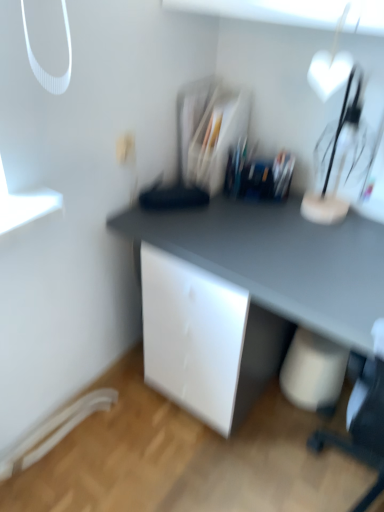
What is the approximate height of white glossy heart-shaped object at upper right?

white glossy heart-shaped object at upper right is 20.17 inches in height.

At what (x,y) coordinates should I click in order to perform the action: click on clear plastic organizer at center. Please return your answer as a coordinate pair (x, y). The width and height of the screenshot is (384, 512). Looking at the image, I should click on (209, 130).

Considering the relative sizes of matte gray desk at center and white glossy heart-shaped object at upper right in the image provided, is matte gray desk at center bigger than white glossy heart-shaped object at upper right?

Yes.

Considering the positions of objects matte gray desk at center and white glossy heart-shaped object at upper right in the image provided, who is behind, matte gray desk at center or white glossy heart-shaped object at upper right?

Positioned behind is white glossy heart-shaped object at upper right.

Considering the relative positions of matte gray desk at center and white glossy heart-shaped object at upper right in the image provided, is matte gray desk at center to the left of white glossy heart-shaped object at upper right from the viewer's perspective?

Yes.

From the image's perspective, is white glossy heart-shaped object at upper right above white matte electric outlet at upper center?

Yes, from the image's perspective, white glossy heart-shaped object at upper right is above white matte electric outlet at upper center.

Is white glossy heart-shaped object at upper right in front of or behind white matte electric outlet at upper center in the image?

white glossy heart-shaped object at upper right is in front of white matte electric outlet at upper center.

Looking at their sizes, would you say white glossy heart-shaped object at upper right is wider or thinner than white matte electric outlet at upper center?

In the image, white glossy heart-shaped object at upper right appears to be wider than white matte electric outlet at upper center.

Is point (334, 149) positioned before point (123, 163)?

No, (334, 149) is behind (123, 163).

You are a GUI agent. You are given a task and a screenshot of the screen. Output one action in this format:
    pyautogui.click(x=<x>, y=<y>)
    Task: Click on the desk on the right of white matte electric outlet at upper center
    The height and width of the screenshot is (512, 384).
    Given the screenshot: What is the action you would take?
    point(280,259)

Is white matte electric outlet at upper center aimed at matte gray desk at center?

No, white matte electric outlet at upper center is not aimed at matte gray desk at center.

From their relative heights in the image, would you say white matte electric outlet at upper center is taller or shorter than matte gray desk at center?

Clearly, white matte electric outlet at upper center is shorter compared to matte gray desk at center.

From a real-world perspective, who is located lower, white matte electric outlet at upper center or matte gray desk at center?

From a 3D spatial view, matte gray desk at center is below.

In terms of size, does white matte electric outlet at upper center appear bigger or smaller than clear plastic organizer at center?

Considering their sizes, white matte electric outlet at upper center takes up less space than clear plastic organizer at center.

Is white matte electric outlet at upper center completely or partially outside of clear plastic organizer at center?

Indeed, white matte electric outlet at upper center is completely outside clear plastic organizer at center.

From the image's perspective, would you say white matte electric outlet at upper center is shown under clear plastic organizer at center?

Yes, from the image's perspective, white matte electric outlet at upper center is beneath clear plastic organizer at center.

Which object is further away from the camera taking this photo, white matte electric outlet at upper center or clear plastic organizer at center?

clear plastic organizer at center is further away from the camera.

Consider the image. Is clear plastic organizer at center wider or thinner than white glossy heart-shaped object at upper right?

Clearly, clear plastic organizer at center has more width compared to white glossy heart-shaped object at upper right.

Is clear plastic organizer at center positioned with its back to white glossy heart-shaped object at upper right?

No, clear plastic organizer at center's orientation is not away from white glossy heart-shaped object at upper right.

From a real-world perspective, which is physically below, clear plastic organizer at center or white glossy heart-shaped object at upper right?

From a 3D spatial view, clear plastic organizer at center is below.

Between point (184, 103) and point (329, 200), which one is positioned in front?

Point (329, 200)

Based on the photo, is the surface of clear plastic organizer at center in direct contact with white matte electric outlet at upper center?

No, clear plastic organizer at center is not touching white matte electric outlet at upper center.

Can you confirm if clear plastic organizer at center is positioned to the left of white matte electric outlet at upper center?

No, clear plastic organizer at center is not to the left of white matte electric outlet at upper center.

Could you measure the distance between clear plastic organizer at center and white matte electric outlet at upper center?

The distance of clear plastic organizer at center from white matte electric outlet at upper center is 12.38 inches.

Considering the relative positions of matte gray desk at center and clear plastic organizer at center in the image provided, is matte gray desk at center to the left of clear plastic organizer at center from the viewer's perspective?

No.

Is matte gray desk at center positioned with its back to clear plastic organizer at center?

That's not correct — matte gray desk at center is not looking away from clear plastic organizer at center.

Is the depth of matte gray desk at center greater than that of clear plastic organizer at center?

No, it is in front of clear plastic organizer at center.

Is clear plastic organizer at center inside matte gray desk at center?

No, clear plastic organizer at center is not inside matte gray desk at center.

Find the location of a particular element. This screenshot has height=512, width=384. table lamp behind the matte gray desk at center is located at coordinates (337, 161).

Find the location of a particular element. electric outlet located on the left of white glossy heart-shaped object at upper right is located at coordinates (126, 149).

Estimate the real-world distances between objects in this image. Which object is closer to clear plastic organizer at center, white glossy heart-shaped object at upper right or matte gray desk at center?

The object closer to clear plastic organizer at center is matte gray desk at center.

Consider the image. Looking at the image, which one is located closer to clear plastic organizer at center, white matte electric outlet at upper center or white glossy heart-shaped object at upper right?

Based on the image, white matte electric outlet at upper center appears to be nearer to clear plastic organizer at center.

Which object lies nearer to the anchor point white glossy heart-shaped object at upper right, clear plastic organizer at center or white matte electric outlet at upper center?

clear plastic organizer at center is positioned closer to the anchor white glossy heart-shaped object at upper right.

Which object lies further to the anchor point matte gray desk at center, clear plastic organizer at center or white glossy heart-shaped object at upper right?

The object further to matte gray desk at center is clear plastic organizer at center.

Which object lies further to the anchor point white glossy heart-shaped object at upper right, white matte electric outlet at upper center or clear plastic organizer at center?

white matte electric outlet at upper center.

From the image, which object appears to be nearer to white glossy heart-shaped object at upper right, clear plastic organizer at center or matte gray desk at center?

The object closer to white glossy heart-shaped object at upper right is matte gray desk at center.

Considering their positions, is matte gray desk at center positioned closer to clear plastic organizer at center than white glossy heart-shaped object at upper right?

Among the two, matte gray desk at center is located nearer to clear plastic organizer at center.

Consider the image. Looking at the image, which one is located further to white glossy heart-shaped object at upper right, matte gray desk at center or clear plastic organizer at center?

Among the two, clear plastic organizer at center is located further to white glossy heart-shaped object at upper right.

Identify the location of electric outlet between white glossy heart-shaped object at upper right and matte gray desk at center vertically. This screenshot has height=512, width=384. (x=126, y=149).

Locate an element on the screen. table lamp that lies between clear plastic organizer at center and matte gray desk at center from top to bottom is located at coordinates (337, 161).

The height and width of the screenshot is (512, 384). Find the location of `shelf situated between white matte electric outlet at upper center and white glossy heart-shaped object at upper right from left to right`. shelf situated between white matte electric outlet at upper center and white glossy heart-shaped object at upper right from left to right is located at coordinates (209, 130).

Find the location of a particular element. Image resolution: width=384 pixels, height=512 pixels. electric outlet between clear plastic organizer at center and matte gray desk at center in the vertical direction is located at coordinates (126, 149).